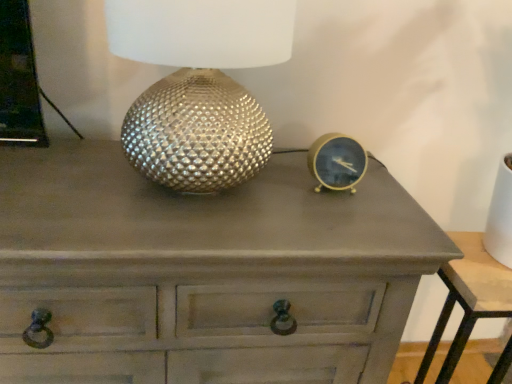
Where is `vacant area on the back side of gold metallic clock at right`? This screenshot has width=512, height=384. vacant area on the back side of gold metallic clock at right is located at coordinates (308, 164).